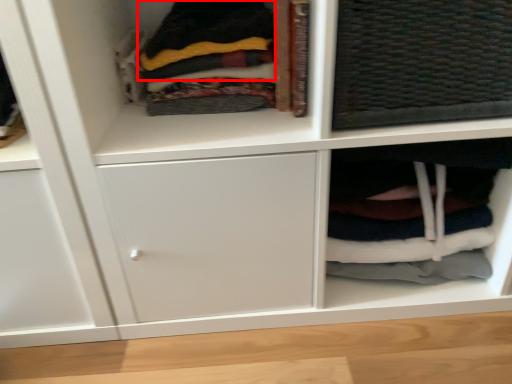
Question: From the image, what is the correct spatial relationship of clothing (annotated by the red box) in relation to cabinet?

Choices:
 (A) right
 (B) left

Answer: (B)